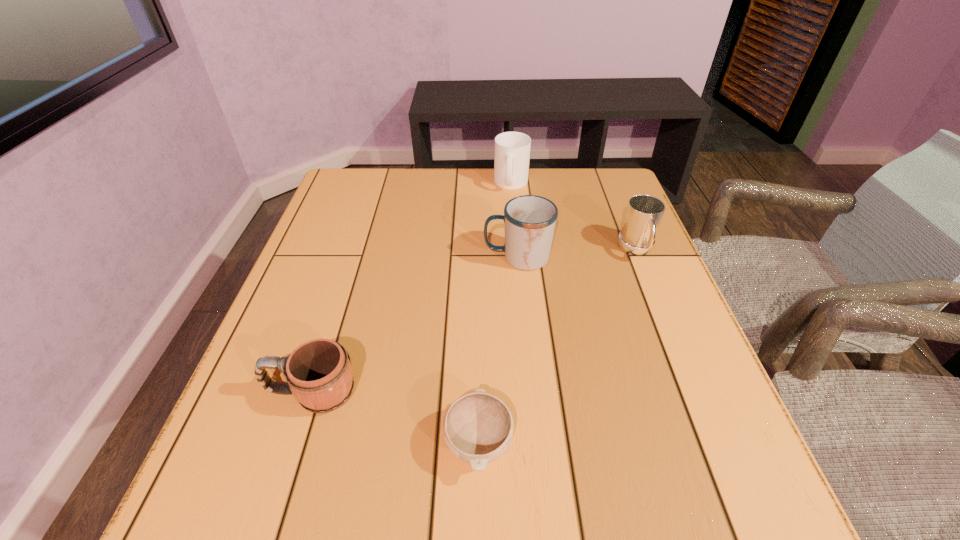
The image size is (960, 540). I want to click on free area in between the rightmost object and the farthest object, so click(574, 217).

Locate an element on the screen. The image size is (960, 540). free space between the leftmost object and the farthest object is located at coordinates (412, 288).

What are the coordinates of `vacant area that lies between the rightmost mug and the bowl` in the screenshot? It's located at (558, 346).

Identify which object is located as the third nearest to the rightmost object. Please provide its 2D coordinates. Your answer should be formatted as a tuple, i.e. [(x, y)], where the tuple contains the x and y coordinates of a point satisfying the conditions above.

[(478, 427)]

Find the location of `the third closest object to the shortest object`. the third closest object to the shortest object is located at coordinates (644, 213).

The height and width of the screenshot is (540, 960). Identify the location of mug identified as the closest to the farthest object. (529, 220).

At what (x,y) coordinates should I click in order to perform the action: click on mug that is the third closest to the rightmost object. Please return your answer as a coordinate pair (x, y). This screenshot has width=960, height=540. Looking at the image, I should click on (319, 374).

This screenshot has width=960, height=540. I want to click on free space that satisfies the following two spatial constraints: 1. on the side of the leftmost object with the handle; 2. on the right side of the bowl, so click(x=296, y=443).

This screenshot has width=960, height=540. What are the coordinates of `blank space that satisfies the following two spatial constraints: 1. on the side of the shortest mug with the handle; 2. on the back side of the bowl` in the screenshot? It's located at (296, 443).

The image size is (960, 540). What are the coordinates of `vacant position in the image that satisfies the following two spatial constraints: 1. on the side of the bowl with the handle; 2. on the left side of the fourth tallest object` in the screenshot? It's located at (296, 443).